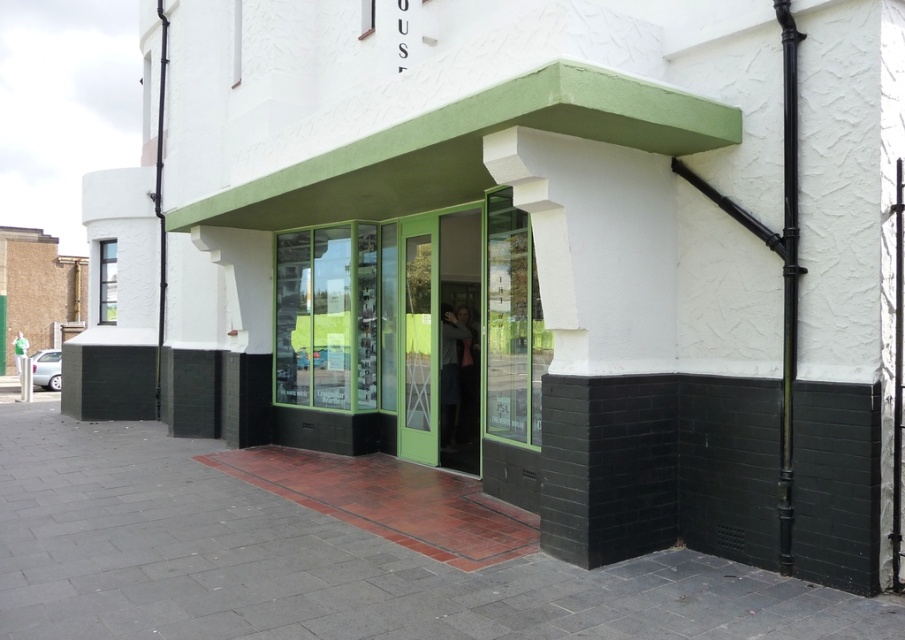
Question: Does green glass door at center have a lesser width compared to white smooth pillar at center?

Choices:
 (A) no
 (B) yes

Answer: (A)

Question: Does smooth brick pavement at center have a smaller size compared to white smooth pillar at center?

Choices:
 (A) no
 (B) yes

Answer: (B)

Question: Which object appears farthest from the camera in this image?

Choices:
 (A) white smooth pillar at center
 (B) smooth brick pavement at center
 (C) green glass door at center

Answer: (C)

Question: Which of the following is the farthest from the observer?

Choices:
 (A) (459, 464)
 (B) (545, 141)

Answer: (A)

Question: Which point is farther to the camera?

Choices:
 (A) white smooth pillar at center
 (B) smooth brick pavement at center

Answer: (A)

Question: Can you confirm if smooth brick pavement at center is positioned below white smooth pillar at center?

Choices:
 (A) no
 (B) yes

Answer: (B)